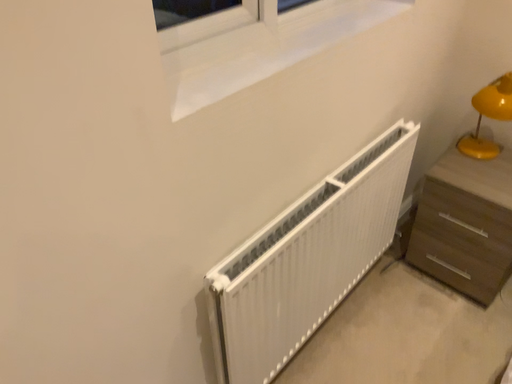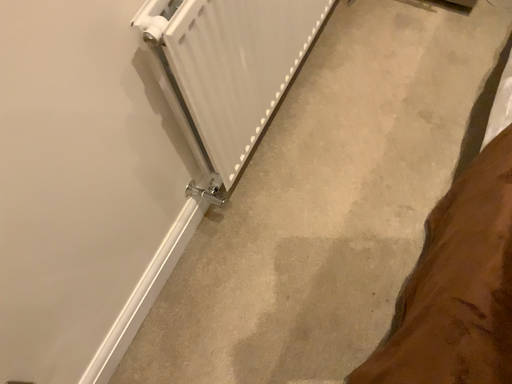
Question: How did the camera likely rotate when shooting the video?

Choices:
 (A) rotated upward
 (B) rotated downward

Answer: (B)